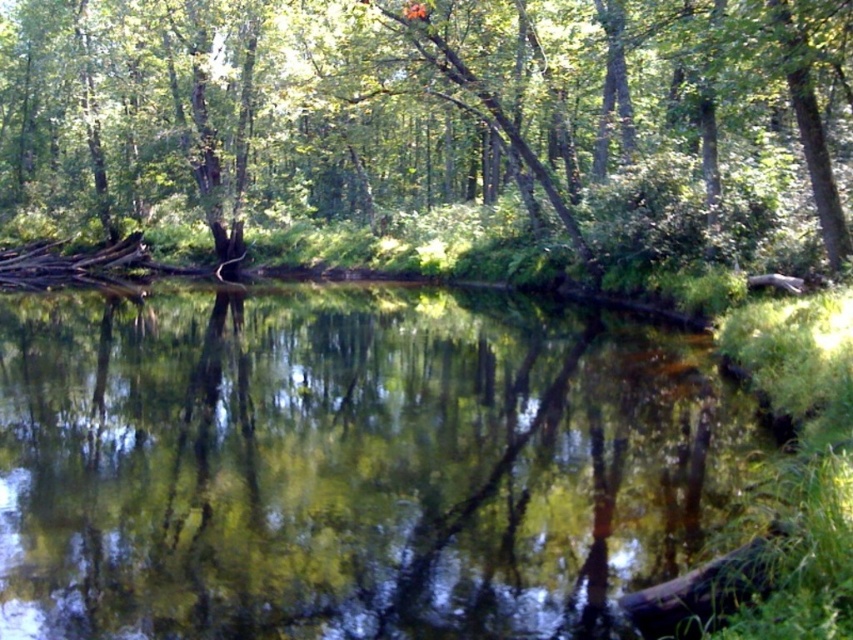
You are planning to take a photo of the green reflective water at center and the green leafy tree at center. Which object will occupy more space in the photo?

The green leafy tree at center will occupy more space in the photo than the green reflective water at center because the green reflective water at center occupies less space than green leafy tree at center.

You are standing in the forest and want to take a photo of the green leafy tree at center and the green reflective water at center. Which object should you focus on first if you want to capture both in a single frame without moving your camera?

You should focus on the green leafy tree at center first because the green reflective water at center is to the right of it, so adjusting the camera to include both would require framing from the tree towards the water.

You are planning to build a small wooden bridge across the green reflective water at center and the green leafy tree at center. Based on their widths, which one would require a longer bridge?

The green leafy tree at center has a greater width than the green reflective water at center, so the bridge over the green leafy tree at center would need to be longer.